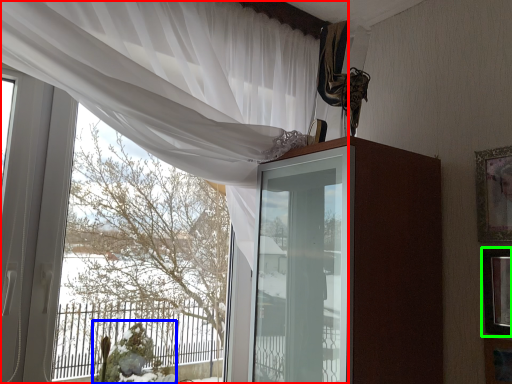
Question: Which object is the closest to the curtain (highlighted by a red box)? Choose among these: floral arrangement (highlighted by a blue box) or picture frame (highlighted by a green box).

Choices:
 (A) floral arrangement
 (B) picture frame

Answer: (B)